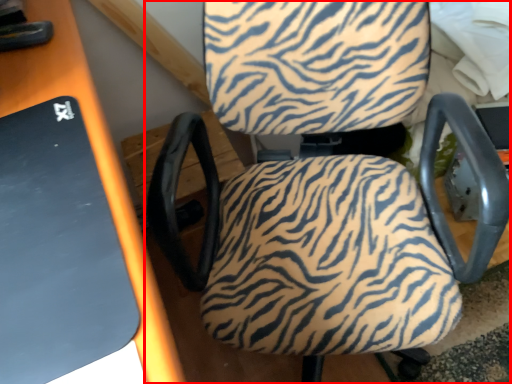
Question: From the image, what is the correct spatial relationship of chair (annotated by the red box) in relation to table?

Choices:
 (A) left
 (B) right

Answer: (B)